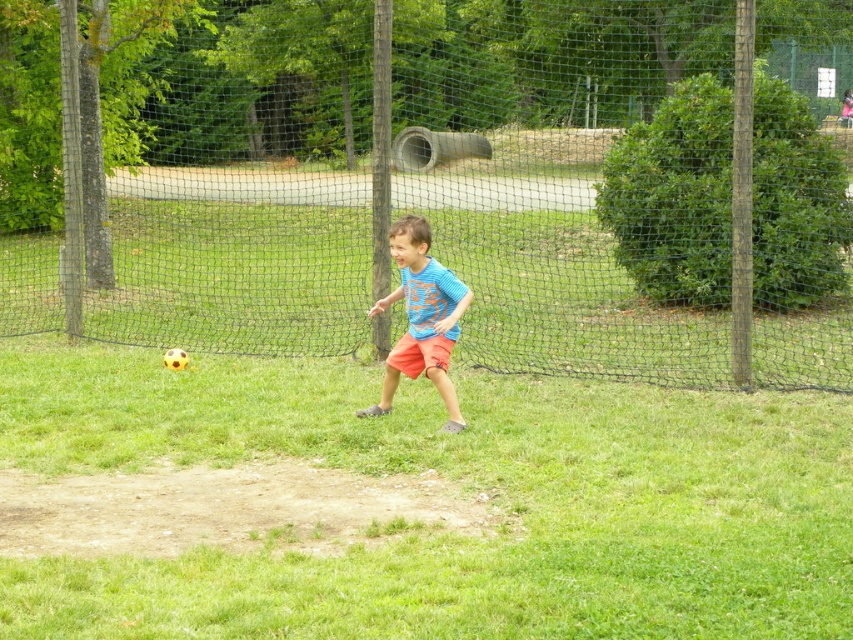
Which of these two, green grass at center or blue cotton shirt at center, stands shorter?

With less height is green grass at center.

Is green grass at center below blue cotton shirt at center?

Yes, green grass at center is below blue cotton shirt at center.

This screenshot has height=640, width=853. What do you see at coordinates (453, 477) in the screenshot?
I see `green grass at center` at bounding box center [453, 477].

The height and width of the screenshot is (640, 853). What are the coordinates of `green grass at center` in the screenshot? It's located at tap(453, 477).

This screenshot has width=853, height=640. I want to click on black mesh fence at center, so click(x=450, y=182).

Is black mesh fence at center below green grass at center?

Incorrect, black mesh fence at center is not positioned below green grass at center.

You are a GUI agent. You are given a task and a screenshot of the screen. Output one action in this format:
    pyautogui.click(x=<x>, y=<y>)
    Task: Click on the black mesh fence at center
    Image resolution: width=853 pixels, height=640 pixels.
    Given the screenshot: What is the action you would take?
    pyautogui.click(x=450, y=182)

Does point (780, 140) come in front of point (445, 432)?

That is False.

Which is more to the left, black mesh fence at center or blue cotton shirt at center?

Positioned to the left is black mesh fence at center.

Locate an element on the screen. The height and width of the screenshot is (640, 853). black mesh fence at center is located at coordinates (450, 182).